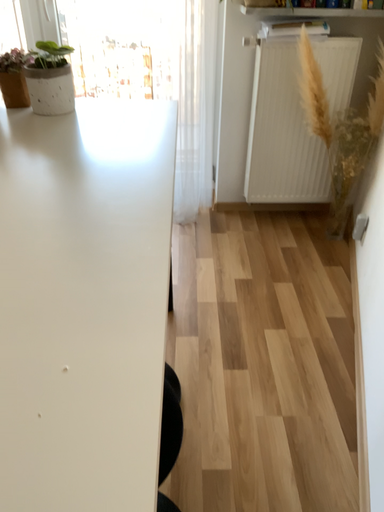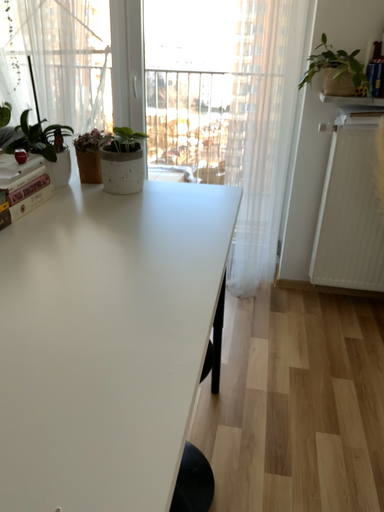
Question: Which way did the camera rotate in the video?

Choices:
 (A) rotated downward
 (B) rotated upward

Answer: (B)